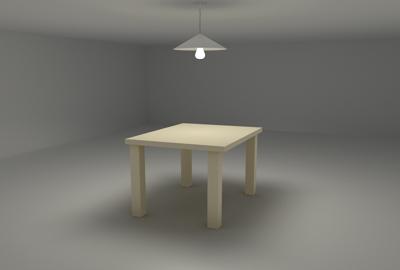
This screenshot has height=270, width=400. In order to click on shadow of lampshade in this screenshot , I will do `click(215, 2)`.